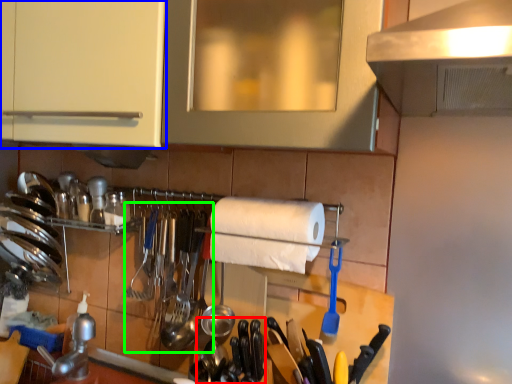
Question: Estimate the real-world distances between objects in this image. Which object is closer to silverware (highlighted by a red box), cabinetry (highlighted by a blue box) or silverware (highlighted by a green box)?

Choices:
 (A) cabinetry
 (B) silverware

Answer: (B)